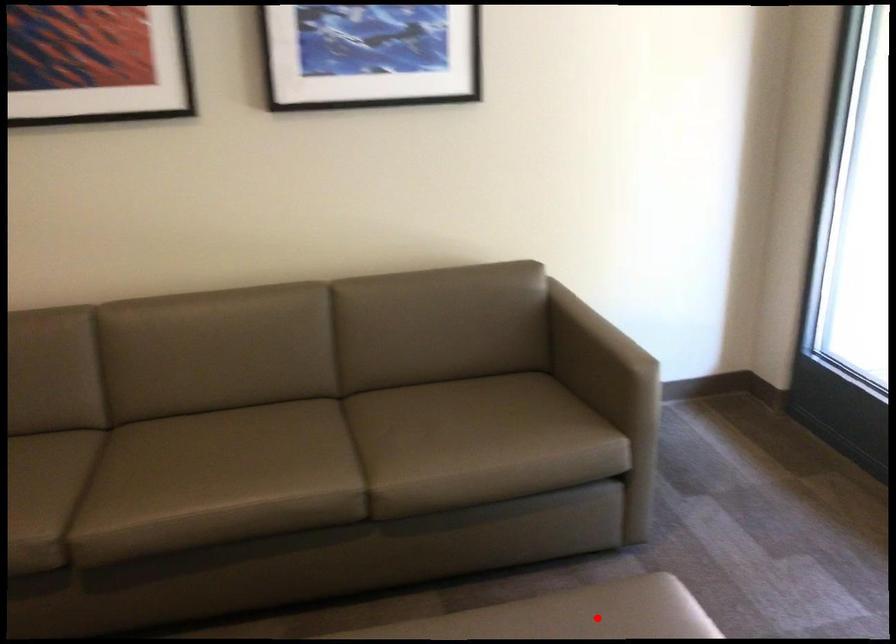
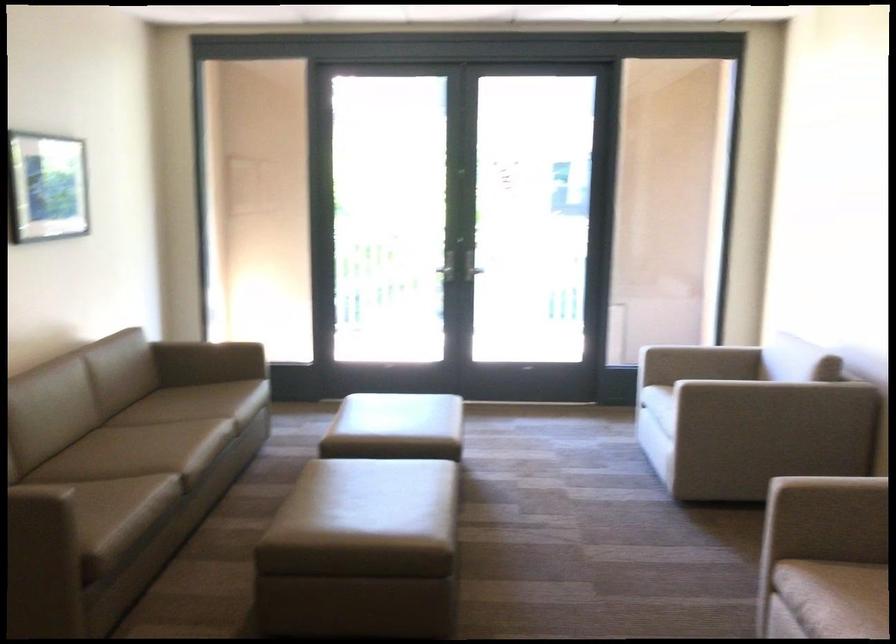
Where in the second image is the point corresponding to the highlighted location from the first image?

(349, 397)